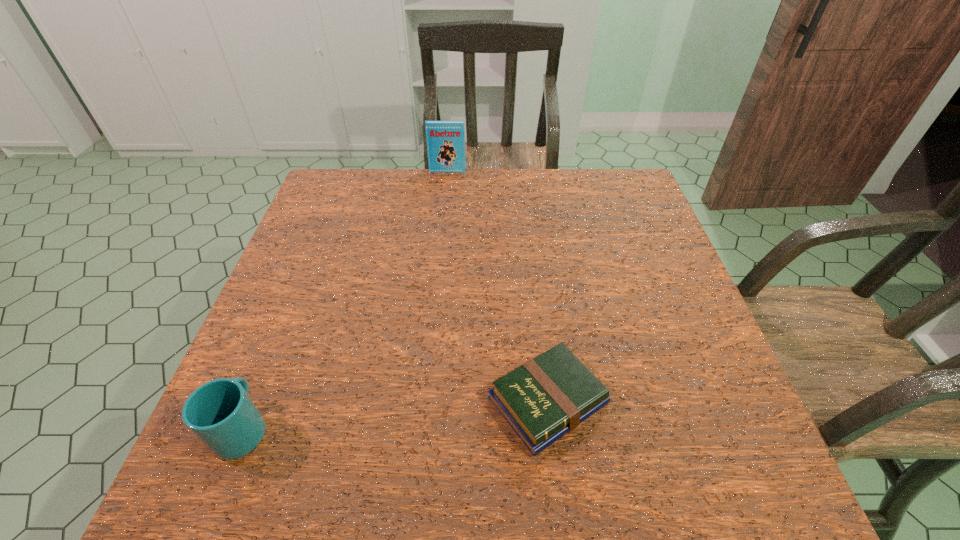
What are the coordinates of `free space at the far left corner` in the screenshot? It's located at (352, 185).

Locate an element on the screen. free space between the cup and the left book is located at coordinates click(x=346, y=300).

Find the location of a particular element. vacant area between the cup and the farther book is located at coordinates (346, 300).

Where is `blank region between the shorter book and the second tallest object`? Image resolution: width=960 pixels, height=540 pixels. blank region between the shorter book and the second tallest object is located at coordinates (396, 414).

This screenshot has width=960, height=540. I want to click on unoccupied area between the shortest object and the second object from left to right, so click(497, 286).

The image size is (960, 540). Find the location of `vacant area between the shortest object and the second object from right to left`. vacant area between the shortest object and the second object from right to left is located at coordinates (497, 286).

Identify the location of free spot between the farthest object and the leftmost object. pyautogui.click(x=346, y=300).

The width and height of the screenshot is (960, 540). What are the coordinates of `free space between the second object from right to left and the leftmost object` in the screenshot? It's located at (346, 300).

You are a GUI agent. You are given a task and a screenshot of the screen. Output one action in this format:
    pyautogui.click(x=<x>, y=<y>)
    Task: Click on the free space between the leftmost object and the farther book
    
    Given the screenshot: What is the action you would take?
    pyautogui.click(x=346, y=300)

Where is `unoccupied area between the second shortest object and the shorter book`? This screenshot has height=540, width=960. unoccupied area between the second shortest object and the shorter book is located at coordinates (396, 414).